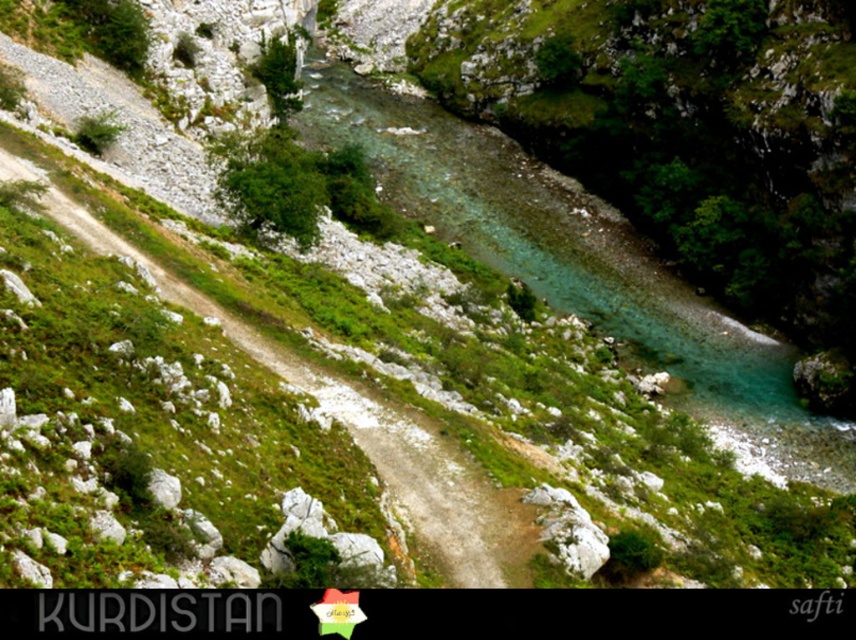
You are a hiker planning to cross the dirt path at center. You notice the clear water at center nearby. Is the water above or below the path?

The clear water at center is located above the dirt path at center, so the water is above the path.

You are a hiker standing at the starting point of the dirt path. You see two points marked on the path ahead of you. The first point is at coordinate point (x=432, y=188) and the second is at point (x=86, y=225). Which point should you reach first as you walk along the path?

You should reach point (x=432, y=188) first because it is closer to you than point (x=86, y=225), which is further away along the path.